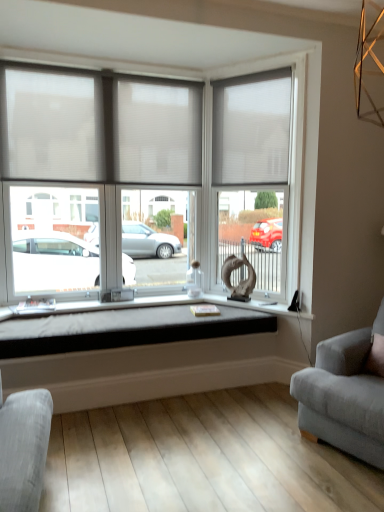
Locate an element on the screen. Image resolution: width=384 pixels, height=512 pixels. vacant point above white fabric window blind at upper right, the 2th window blind when ordered from left to right (from a real-world perspective) is located at coordinates (245, 75).